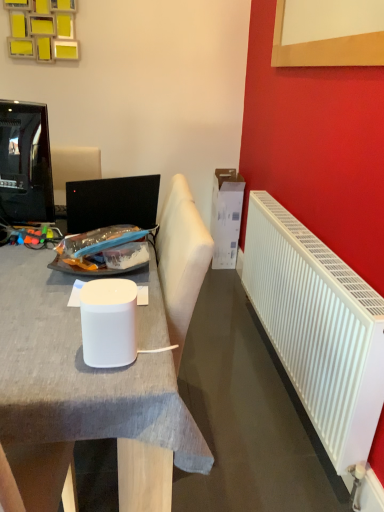
Where is `vacant space in front of white glossy paper cup at center`? vacant space in front of white glossy paper cup at center is located at coordinates (91, 387).